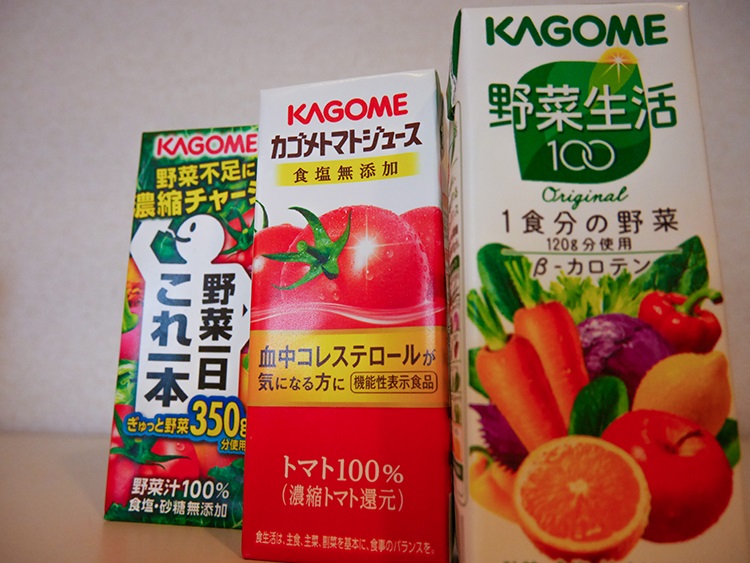
This screenshot has height=563, width=750. What are the coordinates of `boxes` in the screenshot? It's located at (172, 393), (354, 431), (536, 399).